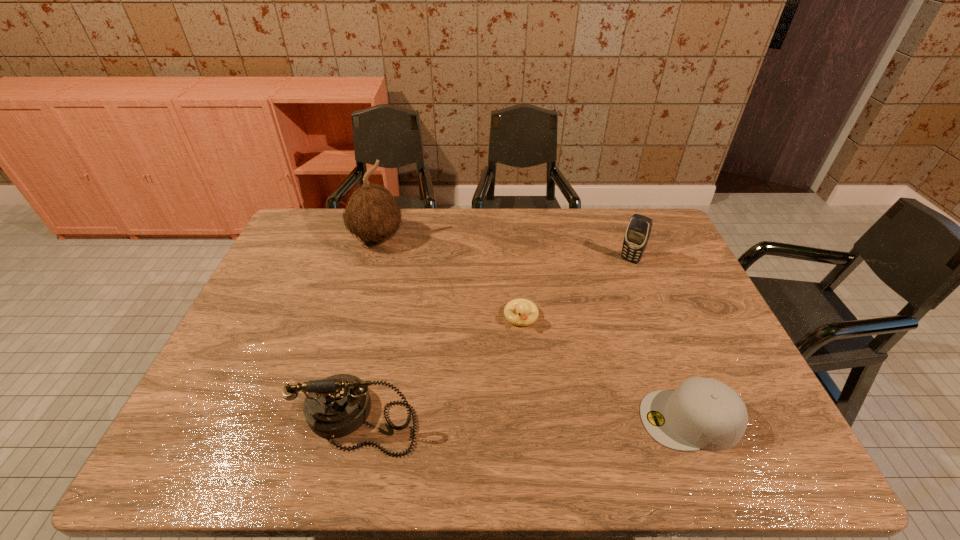
In the image, there is a desktop. Where is `vacant space at the far right corner`? This screenshot has width=960, height=540. vacant space at the far right corner is located at coordinates [x=656, y=228].

At what (x,y) coordinates should I click in order to perform the action: click on free space at the near right corner of the desktop. Please return your answer as a coordinate pair (x, y). The image size is (960, 540). Looking at the image, I should click on (750, 393).

You are a GUI agent. You are given a task and a screenshot of the screen. Output one action in this format:
    pyautogui.click(x=<x>, y=<y>)
    Task: Click on the blank region between the cellular telephone and the duckling
    Image resolution: width=960 pixels, height=540 pixels.
    Given the screenshot: What is the action you would take?
    pyautogui.click(x=576, y=288)

The image size is (960, 540). Identify the location of empty location between the coconut and the cap. (534, 328).

Find the location of `free space between the shortest object and the cellular telephone`. free space between the shortest object and the cellular telephone is located at coordinates (576, 288).

Where is `empty space that is in between the cap and the duckling`? The width and height of the screenshot is (960, 540). empty space that is in between the cap and the duckling is located at coordinates (606, 368).

I want to click on empty space between the duckling and the cellular telephone, so (576, 288).

You are a GUI agent. You are given a task and a screenshot of the screen. Output one action in this format:
    pyautogui.click(x=<x>, y=<y>)
    Task: Click on the unoccupied position between the fourth tallest object and the shortest object
    The image size is (960, 540).
    Given the screenshot: What is the action you would take?
    pyautogui.click(x=606, y=368)

Identify the location of empty space between the telephone and the cap. The image size is (960, 540). (525, 418).

At what (x,y) coordinates should I click in order to perform the action: click on vacant region between the cap and the cellular telephone. Please return your answer as a coordinate pair (x, y). Image resolution: width=960 pixels, height=540 pixels. Looking at the image, I should click on (660, 340).